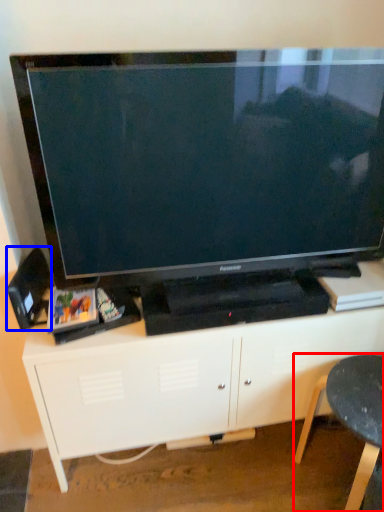
Question: Which point is closer to the camera, furniture (highlighted by a red box) or speaker (highlighted by a blue box)?

Choices:
 (A) furniture
 (B) speaker

Answer: (A)